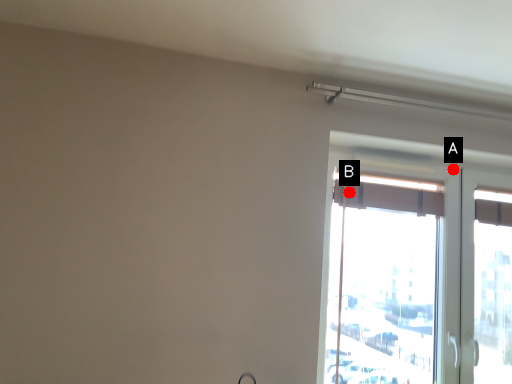
Question: Two points are circled on the image, labeled by A and B beside each circle. Which of the following is the closest to the observer?

Choices:
 (A) A is closer
 (B) B is closer

Answer: (B)